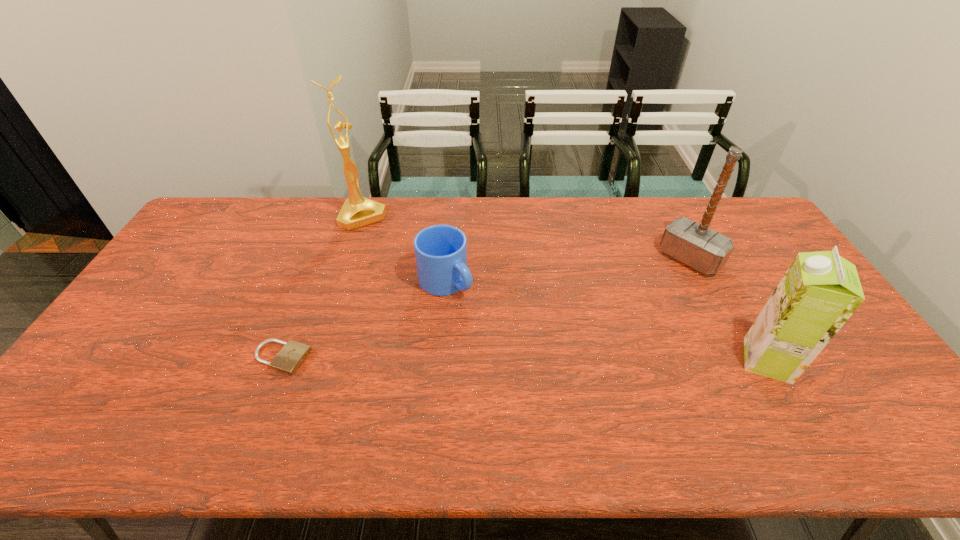
At what (x,y) coordinates should I click in order to perform the action: click on vacant region located on the front-facing side of the tallest object. Please return your answer as a coordinate pair (x, y). The height and width of the screenshot is (540, 960). Looking at the image, I should click on tap(419, 294).

You are a GUI agent. You are given a task and a screenshot of the screen. Output one action in this format:
    pyautogui.click(x=<x>, y=<y>)
    Task: Click on the vacant region located 0.070m on the front-facing side of the tallest object
    The height and width of the screenshot is (540, 960).
    Given the screenshot: What is the action you would take?
    pyautogui.click(x=379, y=240)

The width and height of the screenshot is (960, 540). I want to click on vacant space located 0.200m on the striking surface of the hammer, so click(x=640, y=305).

The width and height of the screenshot is (960, 540). In order to click on vacant space located 0.210m on the striking surface of the hammer in this screenshot , I will do 638,306.

Find the location of a particular element. Image resolution: width=960 pixels, height=540 pixels. vacant space located on the striking surface of the hammer is located at coordinates (611, 332).

You are a GUI agent. You are given a task and a screenshot of the screen. Output one action in this format:
    pyautogui.click(x=<x>, y=<y>)
    Task: Click on the free space located on the side of the fourth tallest object with the handle
    
    Given the screenshot: What is the action you would take?
    pyautogui.click(x=525, y=348)

Where is `free space located on the side of the fourth tallest object with the handle`? This screenshot has height=540, width=960. free space located on the side of the fourth tallest object with the handle is located at coordinates (517, 342).

Where is `vacant region located 0.210m on the side of the fourth tallest object with the handle`? The image size is (960, 540). vacant region located 0.210m on the side of the fourth tallest object with the handle is located at coordinates (515, 340).

The width and height of the screenshot is (960, 540). In order to click on object situated at the far edge in this screenshot , I will do `click(357, 211)`.

The height and width of the screenshot is (540, 960). I want to click on object that is at the near edge, so click(820, 291).